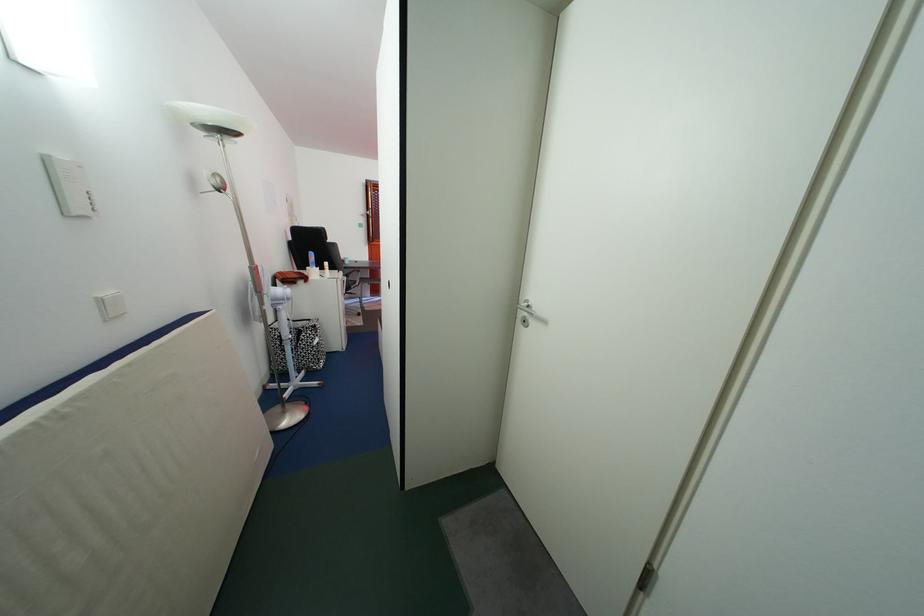
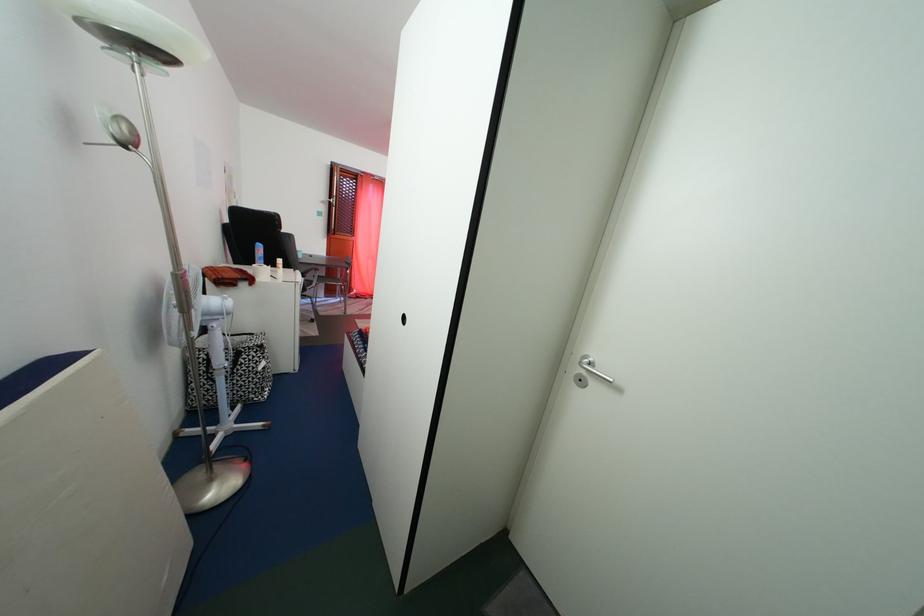
Question: The camera is either moving clockwise (left) or counter-clockwise (right) around the object. The first image is from the beginning of the video and the second image is from the end. Is the camera moving left or right when shooting the video?

Choices:
 (A) Left
 (B) Right

Answer: (A)